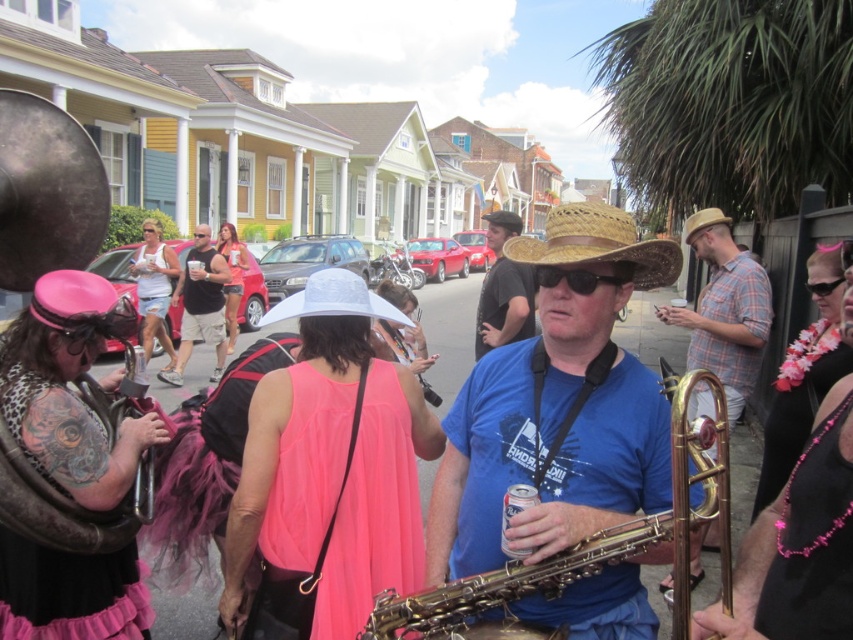
Can you confirm if silver metallic can at center is smaller than straw cowboy hat at center?

Yes, silver metallic can at center is smaller than straw cowboy hat at center.

Can you confirm if silver metallic can at center is wider than straw cowboy hat at center?

Incorrect, silver metallic can at center's width does not surpass straw cowboy hat at center's.

Who is more distant from viewer, (503, 504) or (718, 221)?

Point (718, 221)

This screenshot has width=853, height=640. Find the location of `silver metallic can at center`. silver metallic can at center is located at coordinates (515, 513).

Is pink chiffon dress at center above black tank top at center?

Actually, pink chiffon dress at center is below black tank top at center.

Image resolution: width=853 pixels, height=640 pixels. I want to click on pink chiffon dress at center, so click(x=341, y=531).

Is point (292, 492) positioned in front of point (201, 230)?

Yes, it is.

Image resolution: width=853 pixels, height=640 pixels. I want to click on pink chiffon dress at center, so click(341, 531).

Is blue fabric shirt at center smaller than black tank top at center?

Correct, blue fabric shirt at center occupies less space than black tank top at center.

Based on the photo, is blue fabric shirt at center taller than black tank top at center?

Incorrect, blue fabric shirt at center's height is not larger of black tank top at center's.

Does point (639, 426) come farther from viewer compared to point (207, 236)?

No, it is not.

I want to click on blue fabric shirt at center, so click(556, 410).